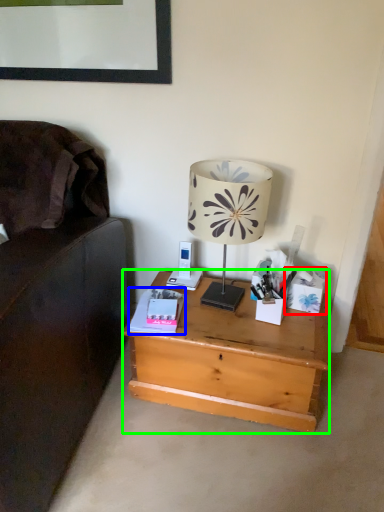
Question: Which object is positioned farthest from box (highlighted by a red box)? Select from paperback book (highlighted by a blue box) and desk (highlighted by a green box).

Choices:
 (A) paperback book
 (B) desk

Answer: (A)